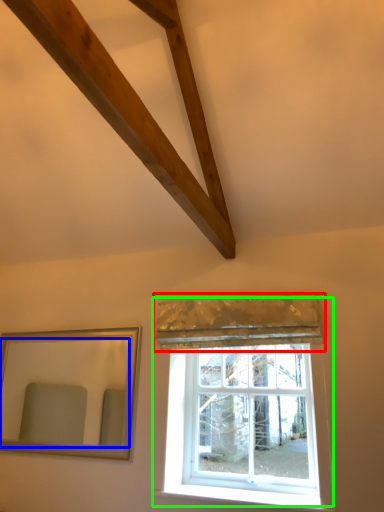
Question: Which object is the closest to the curtain (highlighted by a red box)? Choose among these: mirror (highlighted by a blue box) or window (highlighted by a green box).

Choices:
 (A) mirror
 (B) window

Answer: (B)